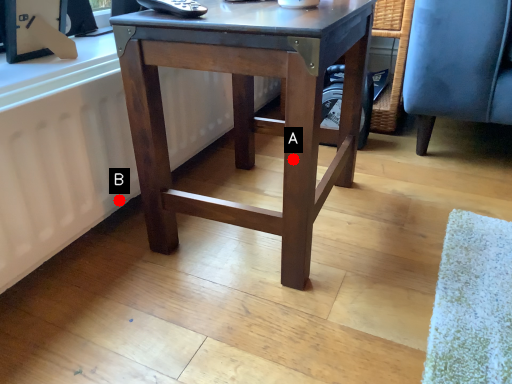
Question: Two points are circled on the image, labeled by A and B beside each circle. Which point appears closest to the camera in this image?

Choices:
 (A) A is closer
 (B) B is closer

Answer: (A)